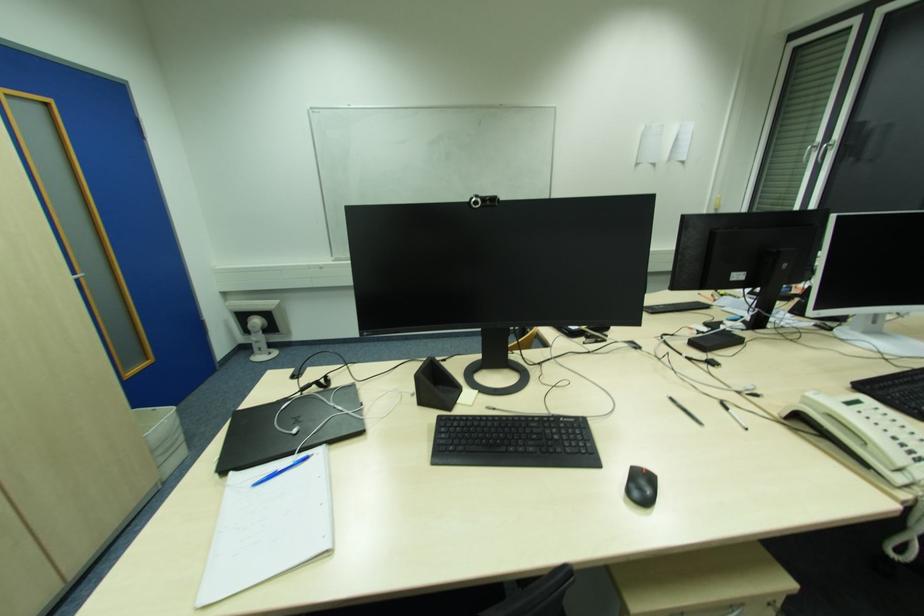
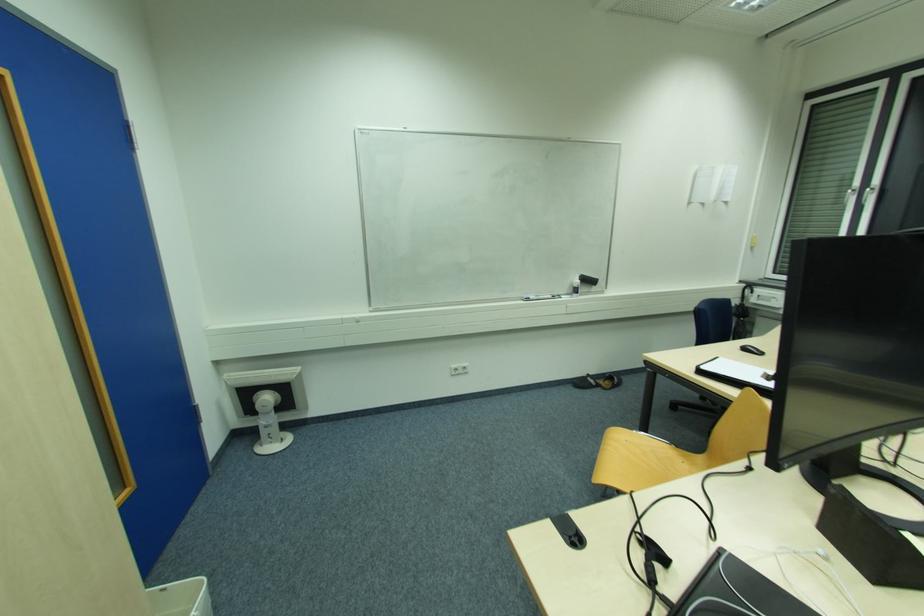
Locate, in the second image, the point that corresponds to (x=481, y=126) in the first image.

(550, 158)